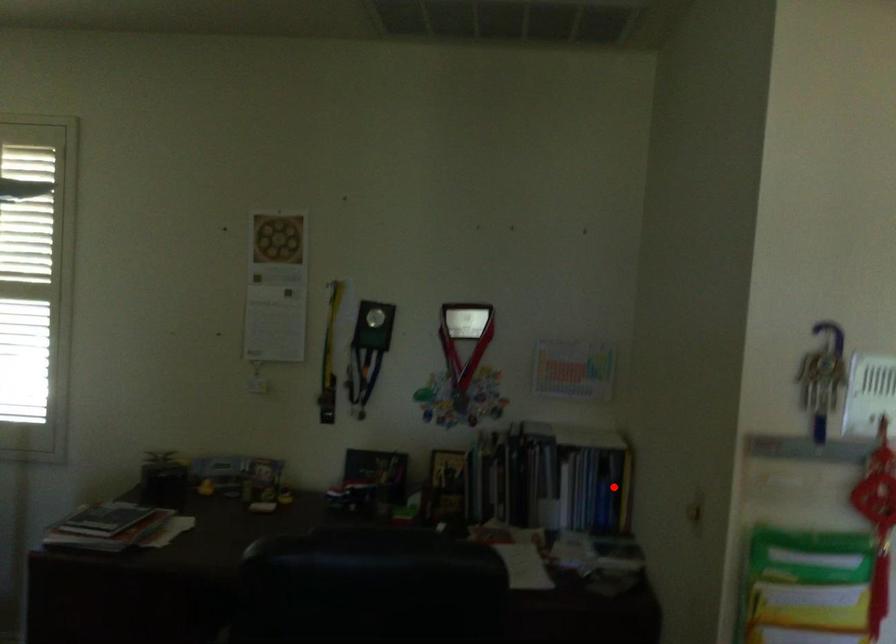
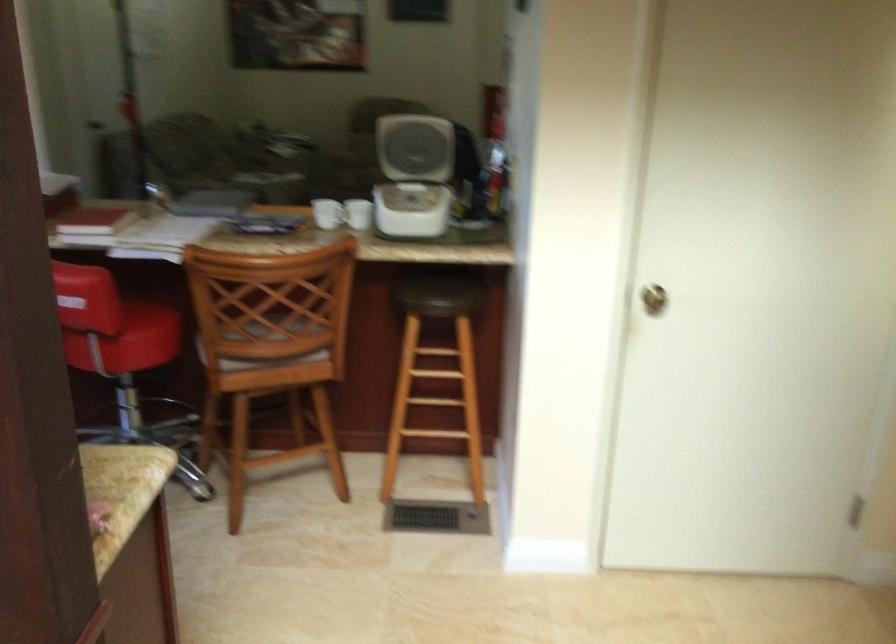
Question: I am providing you with two images of the same scene from different viewpoints. A red point is marked on the first image. Can you still see the location of the red point in image 2?

Choices:
 (A) Yes
 (B) No

Answer: (B)